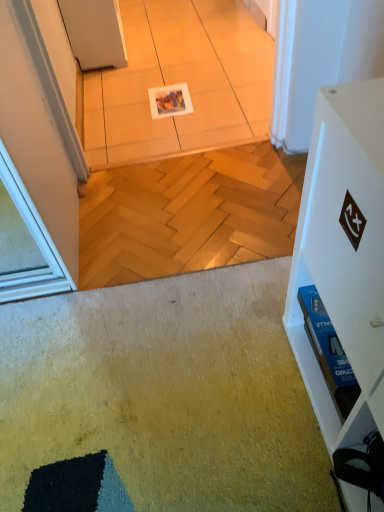
Question: Is white glossy tile at center bigger than white matte cabinet at right?

Choices:
 (A) yes
 (B) no

Answer: (B)

Question: Does white glossy tile at center have a greater height compared to white matte cabinet at right?

Choices:
 (A) no
 (B) yes

Answer: (A)

Question: Can you confirm if white glossy tile at center is positioned to the right of white matte cabinet at right?

Choices:
 (A) no
 (B) yes

Answer: (A)

Question: Can you confirm if white glossy tile at center is smaller than white matte cabinet at right?

Choices:
 (A) no
 (B) yes

Answer: (B)

Question: Does white glossy tile at center turn towards white matte cabinet at right?

Choices:
 (A) no
 (B) yes

Answer: (A)

Question: Considering the relative sizes of white glossy tile at center and white matte cabinet at right in the image provided, is white glossy tile at center shorter than white matte cabinet at right?

Choices:
 (A) no
 (B) yes

Answer: (B)

Question: Would you say white glossy tile at center is part of white matte cabinet at right's contents?

Choices:
 (A) yes
 (B) no

Answer: (B)

Question: Is white matte cabinet at right positioned behind white glossy tile at center?

Choices:
 (A) yes
 (B) no

Answer: (B)

Question: Is the depth of white matte cabinet at right less than that of white glossy tile at center?

Choices:
 (A) no
 (B) yes

Answer: (B)

Question: Is white matte cabinet at right facing away from white glossy tile at center?

Choices:
 (A) no
 (B) yes

Answer: (A)

Question: Does white matte cabinet at right have a greater width compared to white glossy tile at center?

Choices:
 (A) no
 (B) yes

Answer: (A)

Question: From a real-world perspective, does white matte cabinet at right stand above white glossy tile at center?

Choices:
 (A) yes
 (B) no

Answer: (A)

Question: Is point (253, 132) positioned closer to the camera than point (327, 247)?

Choices:
 (A) farther
 (B) closer

Answer: (A)